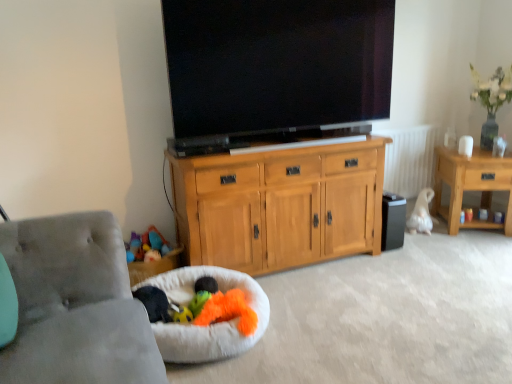
Find the location of a particular element. The image size is (512, 384). vacant space that's between light wood cabinet at center and white fluffy dog bed at lower left is located at coordinates (311, 296).